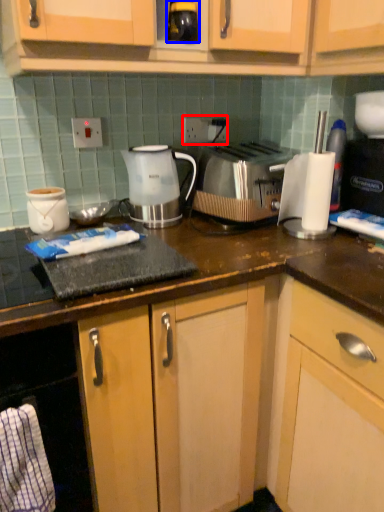
Question: Which object is further to the camera taking this photo, electric outlet (highlighted by a red box) or beverage (highlighted by a blue box)?

Choices:
 (A) electric outlet
 (B) beverage

Answer: (A)